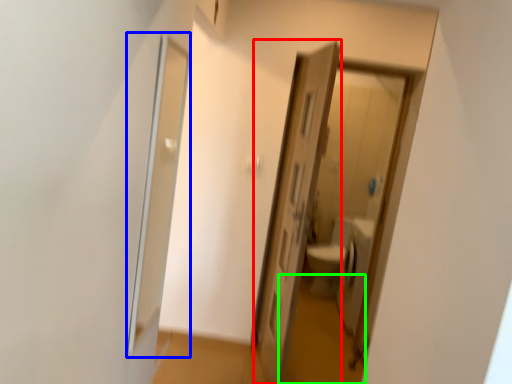
Question: Which object is positioned farthest from door (highlighted by a red box)? Select from screen door (highlighted by a blue box) and path (highlighted by a green box).

Choices:
 (A) screen door
 (B) path

Answer: (B)